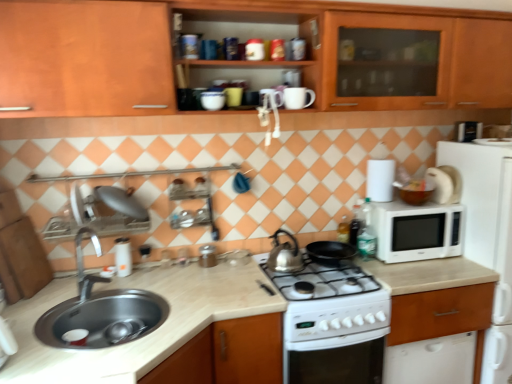
Describe the element at coordinates (380, 180) in the screenshot. Image resolution: width=512 pixels, height=384 pixels. I see `white matte paper towel at upper right` at that location.

Describe the element at coordinates (335, 341) in the screenshot. I see `white glossy oven at center` at that location.

Identify the location of metallic silver canister at center, the 2th appliance positioned from the front. (207, 256).

What do you see at coordinates (207, 256) in the screenshot? The image size is (512, 384). I see `metallic silver canister at center, the 1th appliance ordered from the bottom` at bounding box center [207, 256].

The width and height of the screenshot is (512, 384). What do you see at coordinates (146, 336) in the screenshot?
I see `white marble countertop at lower left` at bounding box center [146, 336].

You are a GUI agent. You are given a task and a screenshot of the screen. Output one action in this format:
    pyautogui.click(x=<x>, y=<y>)
    Task: Click on the white matte microwave at right
    Image resolution: width=512 pixels, height=384 pixels.
    Given the screenshot: What is the action you would take?
    pyautogui.click(x=487, y=236)

How much space does translucent plastic bottle at stove top, which is counted as the second bottle, starting from the right, occupy horizontally?

The width of translucent plastic bottle at stove top, which is counted as the second bottle, starting from the right, is 3.34 inches.

This screenshot has height=384, width=512. Identify the location of metallic silver toaster at upper right, placed as the 1th appliance when sorted from back to front. (468, 131).

Where is `kitchen appliance lying behind the white glossy gas stove at center`? kitchen appliance lying behind the white glossy gas stove at center is located at coordinates click(x=285, y=255).

Could you tell me if white glossy gas stove at center is facing satin silver kettle at center?

No, white glossy gas stove at center does not turn towards satin silver kettle at center.

Between white glossy gas stove at center and satin silver kettle at center, which one has less height?

Standing shorter between the two is satin silver kettle at center.

Does metallic silver toaster at upper right, which is the 3th appliance from front to back, have a greater height compared to matte wood cabinet at left, the second cabinetry viewed from the top?

Incorrect, the height of metallic silver toaster at upper right, which is the 3th appliance from front to back, is not larger of that of matte wood cabinet at left, the second cabinetry viewed from the top.

Which object is positioned more to the right, metallic silver toaster at upper right, marked as the first appliance in a top-to-bottom arrangement, or matte wood cabinet at left, which ranks as the 2th cabinetry in bottom-to-top order?

From the viewer's perspective, metallic silver toaster at upper right, marked as the first appliance in a top-to-bottom arrangement, appears more on the right side.

From a real-world perspective, starting from the metallic silver toaster at upper right, the 1th appliance positioned from the right, which cabinetry is the 1st one below it? Please provide its 2D coordinates.

[(22, 261)]

Is metallic silver toaster at upper right, the 1th appliance positioned from the right, outside of matte wood cabinet at left, which ranks as the 2th cabinetry in bottom-to-top order?

Yes.

Is white marble countertop at lower left outside of wooden cabinet at right, which is the 1th cabinetry from bottom to top?

Yes, white marble countertop at lower left is located beyond the bounds of wooden cabinet at right, which is the 1th cabinetry from bottom to top.

Consider the image. Could you tell me if white marble countertop at lower left is facing wooden cabinet at right, which is the 3th cabinetry in top-to-bottom order?

Yes.

How much distance is there between white marble countertop at lower left and wooden cabinet at right, which is the 3th cabinetry in top-to-bottom order?

white marble countertop at lower left and wooden cabinet at right, which is the 3th cabinetry in top-to-bottom order, are 34.47 inches apart.

Can you confirm if white marble countertop at lower left is positioned to the left of wooden cabinet at right, which is the 1th cabinetry from bottom to top?

Yes.

Based on their sizes in the image, would you say white matte paper towel at upper right is bigger or smaller than metallic silver toaster at upper right, which is counted as the 3th appliance, starting from the bottom?

In the image, white matte paper towel at upper right appears to be larger than metallic silver toaster at upper right, which is counted as the 3th appliance, starting from the bottom.

From a real-world perspective, is white matte paper towel at upper right positioned above or below metallic silver toaster at upper right, the 1th appliance positioned from the right?

Clearly, from a real-world perspective, white matte paper towel at upper right is below metallic silver toaster at upper right, the 1th appliance positioned from the right.

Could you tell me if white matte paper towel at upper right is facing metallic silver toaster at upper right, marked as the first appliance in a top-to-bottom arrangement?

No, white matte paper towel at upper right is not turned towards metallic silver toaster at upper right, marked as the first appliance in a top-to-bottom arrangement.

What's the angular difference between white matte paper towel at upper right and metallic silver toaster at upper right, which is counted as the 3th appliance, starting from the bottom,'s facing directions?

white matte paper towel at upper right and metallic silver toaster at upper right, which is counted as the 3th appliance, starting from the bottom, are facing 12.8 degrees away from each other.

Can you confirm if white glossy oven at center is shorter than white glossy water filter at left, the third appliance viewed from the back?

In fact, white glossy oven at center may be taller than white glossy water filter at left, the third appliance viewed from the back.

From the white glossy oven at center, count 1st appliances backward and point to it. Please provide its 2D coordinates.

[(123, 257)]

From a real-world perspective, is white glossy oven at center physically below white glossy water filter at left, the 1th appliance positioned from the left?

Indeed, from a real-world perspective, white glossy oven at center is positioned beneath white glossy water filter at left, the 1th appliance positioned from the left.

Is white matte microwave at right located outside translucent plastic bottle at stove top, marked as the first bottle in a left-to-right arrangement?

Indeed, white matte microwave at right is completely outside translucent plastic bottle at stove top, marked as the first bottle in a left-to-right arrangement.

From the image's perspective, between white matte microwave at right and translucent plastic bottle at stove top, marked as the first bottle in a left-to-right arrangement, which one is located above?

translucent plastic bottle at stove top, marked as the first bottle in a left-to-right arrangement, from the image's perspective.

You are a GUI agent. You are given a task and a screenshot of the screen. Output one action in this format:
    pyautogui.click(x=<x>, y=<y>)
    Task: Click on the bottle that is the 2nd object to the left of the white matte microwave at right, starting at the anchor
    Image resolution: width=512 pixels, height=384 pixels.
    Given the screenshot: What is the action you would take?
    pyautogui.click(x=343, y=230)

From a real-world perspective, is white glossy water filter at left, the third appliance viewed from the back, above or below silver metallic faucet at sink left?

white glossy water filter at left, the third appliance viewed from the back, is below silver metallic faucet at sink left.

Which appliance is the 1st one when counting from the back of the silver metallic faucet at sink left? Please provide its 2D coordinates.

[(123, 257)]

Is white glossy water filter at left, positioned as the second appliance in top-to-bottom order, surrounding silver metallic faucet at sink left?

Actually, silver metallic faucet at sink left is outside white glossy water filter at left, positioned as the second appliance in top-to-bottom order.

Which object is further away from the camera, white glossy water filter at left, positioned as the second appliance in top-to-bottom order, or silver metallic faucet at sink left?

white glossy water filter at left, positioned as the second appliance in top-to-bottom order, is further from the camera.

You are a GUI agent. You are given a task and a screenshot of the screen. Output one action in this format:
    pyautogui.click(x=<x>, y=<y>)
    Task: Click on the kitchen appliance above the white glossy gas stove at center (from a real-world perspective)
    
    Given the screenshot: What is the action you would take?
    pos(285,255)

Find the location of a particular element. Image resolution: width=512 pixels, height=384 pixels. the 3rd cabinetry to the left of the metallic silver toaster at upper right, which is the 3th appliance from front to back, counting from the anchor's position is located at coordinates (22, 261).

Estimate the real-world distances between objects in this image. Which object is closer to white matte microwave at right, white glossy oven at center or translucent plastic bottle at stove top, which is counted as the second bottle, starting from the right?

translucent plastic bottle at stove top, which is counted as the second bottle, starting from the right, is closer to white matte microwave at right.

Considering their positions, is white glossy water filter at left, which is the 2th appliance from bottom to top, positioned further to matte wood cabinet at left, the second cabinetry viewed from the top, than white glossy oven at center?

white glossy oven at center.

From the image, which object appears to be nearer to white marble countertop at lower left, white glossy oven at center or silver metallic faucet at sink left?

silver metallic faucet at sink left.

Based on their spatial positions, is white matte microwave at right or satin silver kettle at center further from translucent plastic bottle at stove right, acting as the first bottle starting from the right?

Based on the image, white matte microwave at right appears to be further to translucent plastic bottle at stove right, acting as the first bottle starting from the right.

When comparing their distances from satin silver kettle at center, does white glossy oven at center or white glossy water filter at left, the third appliance viewed from the back, seem further?

white glossy water filter at left, the third appliance viewed from the back, is positioned further to the anchor satin silver kettle at center.

Which object lies nearer to the anchor point white matte paper towel at upper right, wooden cabinet at upper center, which appears as the first cabinetry when viewed from the top, or white glossy gas stove at center?

white glossy gas stove at center lies closer to white matte paper towel at upper right than the other object.

Based on their spatial positions, is silver metallic faucet at sink left or matte wood cabinet at left, which ranks as the 2th cabinetry in bottom-to-top order, closer to white matte microwave at right?

Among the two, silver metallic faucet at sink left is located nearer to white matte microwave at right.

Considering their positions, is satin silver kettle at center positioned closer to translucent plastic bottle at stove right, acting as the first bottle starting from the right, than matte wood cabinet at left, the second cabinetry viewed from the top?

The object closer to translucent plastic bottle at stove right, acting as the first bottle starting from the right, is satin silver kettle at center.

Where is `oven between matte wood cabinet at left, the second cabinetry viewed from the top, and white matte paper towel at upper right, in the horizontal direction`? This screenshot has width=512, height=384. oven between matte wood cabinet at left, the second cabinetry viewed from the top, and white matte paper towel at upper right, in the horizontal direction is located at coordinates (335, 341).

Where is `appliance situated between white glossy water filter at left, the 1th appliance positioned from the left, and white matte paper towel at upper right from left to right`? This screenshot has height=384, width=512. appliance situated between white glossy water filter at left, the 1th appliance positioned from the left, and white matte paper towel at upper right from left to right is located at coordinates (207, 256).

I want to click on microwave oven between matte wood cabinet at left, which ranks as the 2th cabinetry in bottom-to-top order, and white matte microwave at right, in the horizontal direction, so click(417, 231).

Where is `paper towel between matte wood cabinet at left, the second cabinetry viewed from the top, and wooden cabinet at right, which is the 1th cabinetry from bottom to top, in the horizontal direction`? paper towel between matte wood cabinet at left, the second cabinetry viewed from the top, and wooden cabinet at right, which is the 1th cabinetry from bottom to top, in the horizontal direction is located at coordinates (380, 180).